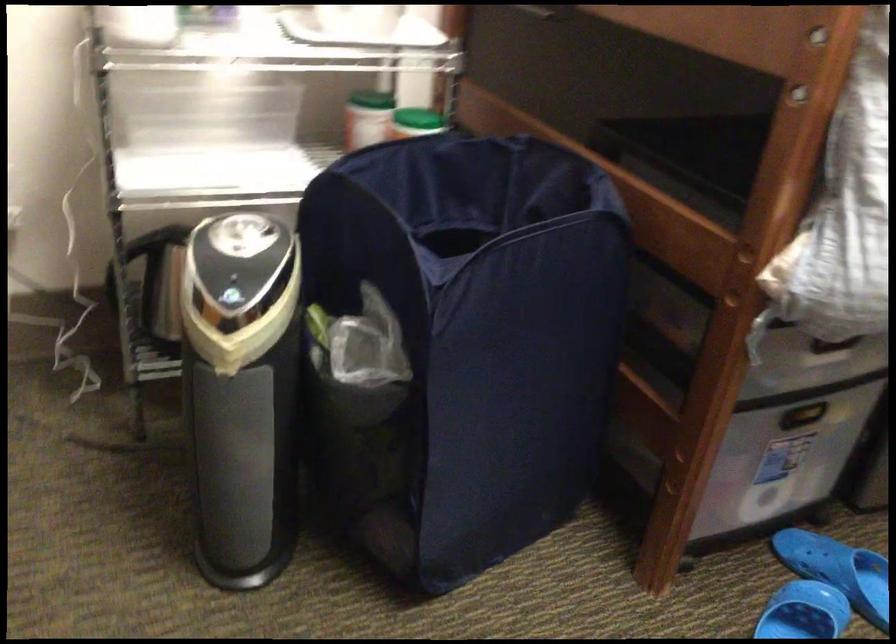
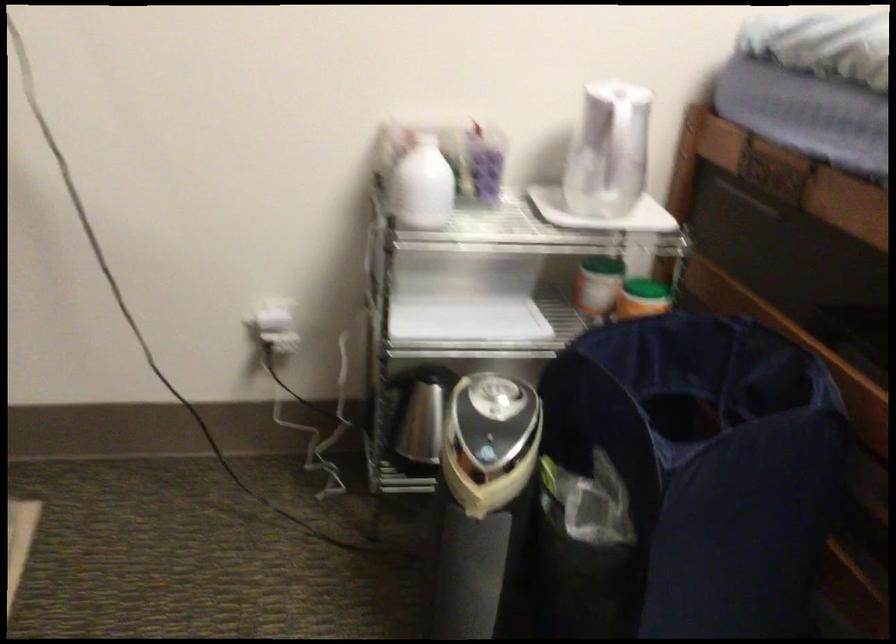
Where in the second image is the point corresponding to (x=412, y=124) from the first image?

(642, 298)